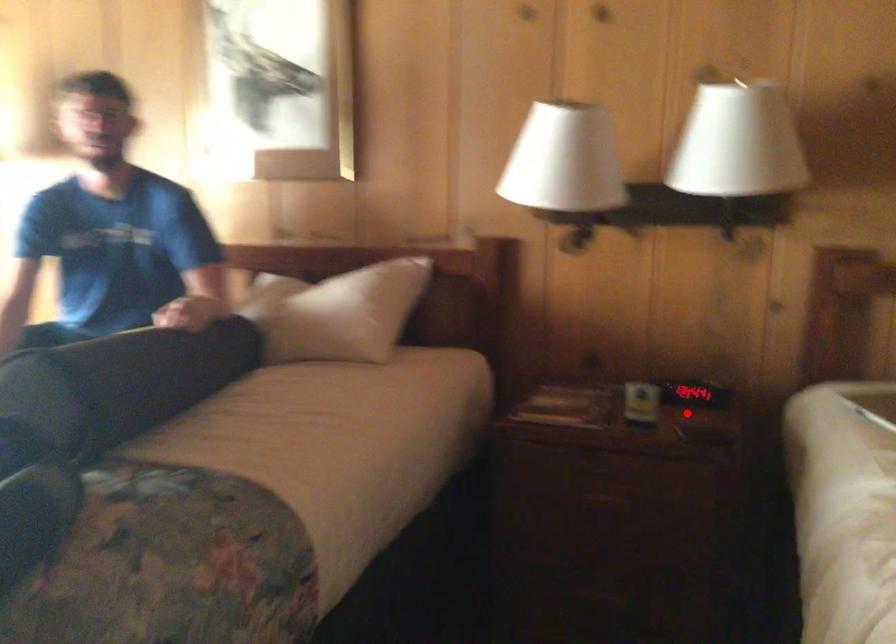
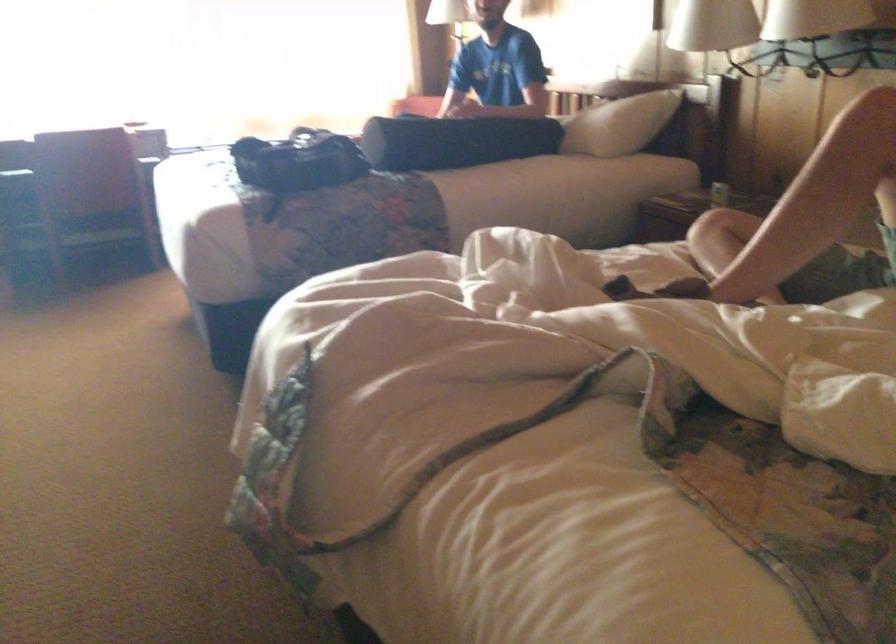
Question: A red point is marked in image1. In image2, is the corresponding 3D point closer to the camera or farther? Reply with the corresponding letter.

Choices:
 (A) The corresponding 3D point is closer.
 (B) The corresponding 3D point is farther.

Answer: (B)